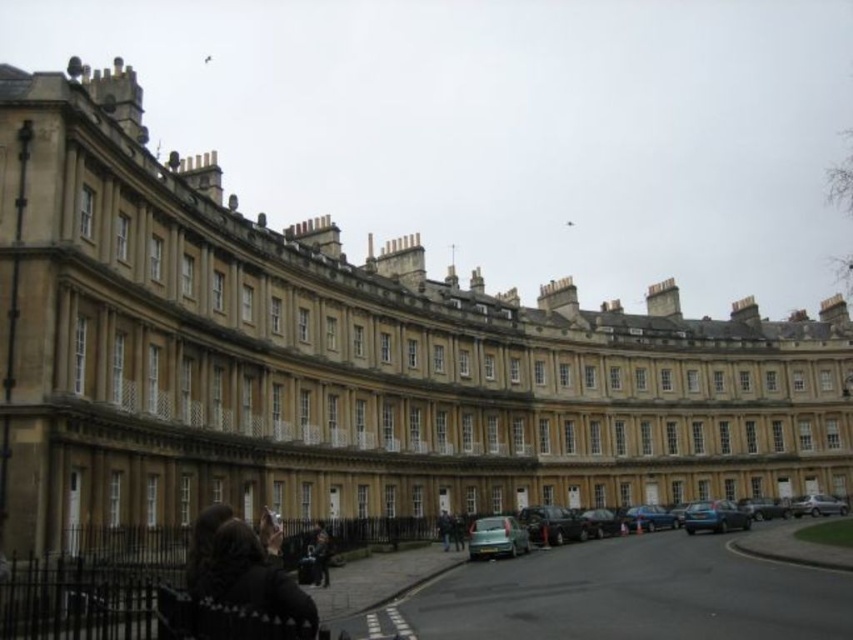
Measure the distance between shiny blue sedan at lower right and shiny black car at lower center.

The distance of shiny blue sedan at lower right from shiny black car at lower center is 17.16 feet.

Can you confirm if shiny blue sedan at lower right is wider than shiny black car at lower center?

Correct, the width of shiny blue sedan at lower right exceeds that of shiny black car at lower center.

Is point (643, 525) positioned before point (606, 522)?

No.

The image size is (853, 640). I want to click on shiny blue sedan at lower right, so click(648, 516).

Which is behind, point (751, 518) or point (561, 532)?

The point (751, 518) is behind.

Who is lower down, matte black car at center or shiny black car at center?

matte black car at center is below.

Is point (694, 528) farther from camera compared to point (529, 522)?

Yes, it is.

The image size is (853, 640). Find the location of `matte black car at center`. matte black car at center is located at coordinates (798, 550).

Is dark brown leather jacket at lower left thinner than matte black car at center?

Yes.

Who is positioned more to the right, dark brown leather jacket at lower left or matte black car at center?

matte black car at center is more to the right.

Find the location of `dark brown leather jacket at lower left`. dark brown leather jacket at lower left is located at coordinates (242, 572).